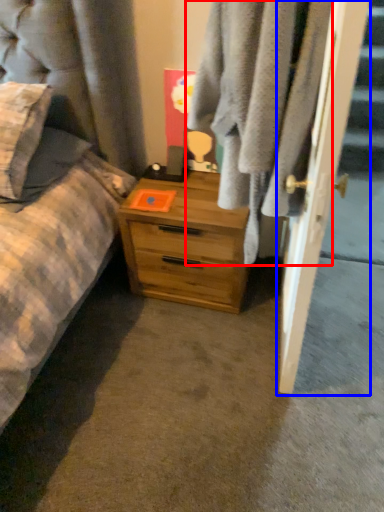
Question: Which of the following is the farthest to the observer, clothing (highlighted by a red box) or door (highlighted by a blue box)?

Choices:
 (A) clothing
 (B) door

Answer: (B)